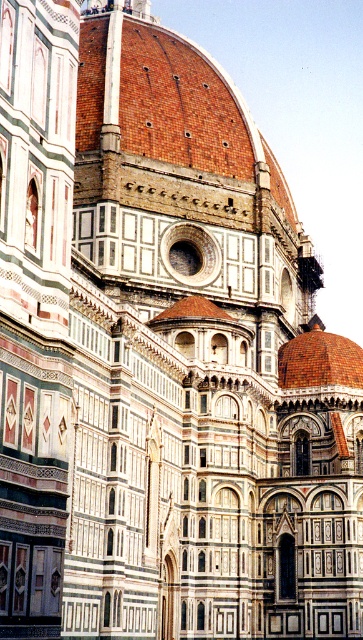
You are standing at the base of the Florence Cathedral and want to take a photo of the terracotta brick dome at center. If your camera has a maximum zoom range of 50 meters, will you be able to capture the entire dome in your photo without moving closer?

The terracotta brick dome at center is 80.03 meters away from the viewer. Since the camera can only zoom up to 50 meters, you will not be able to capture the entire dome without moving closer.

You are an architect analyzing the Florence Cathedral. You observe the terracotta brick dome at center and the brown tiled dome at center. Which dome is situated higher in the structure?

The terracotta brick dome at center is positioned over the brown tiled dome at center, meaning it is higher up in the structure.

You are a tourist standing in front of the Florence Cathedral. You see the terracotta brick dome at center and the brown tiled dome at center. Which one is positioned to the left?

The terracotta brick dome at center is positioned to the left of the brown tiled dome at center.